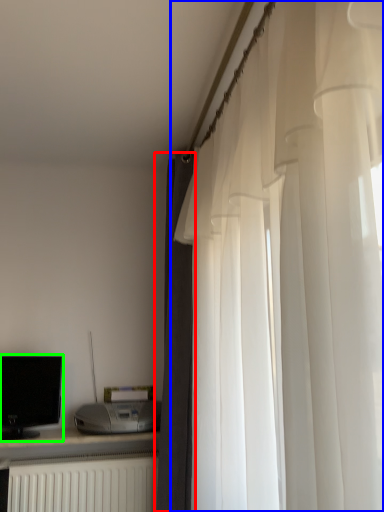
Question: Which object is the farthest from curtain (highlighted by a red box)? Choose among these: curtain (highlighted by a blue box) or computer monitor (highlighted by a green box).

Choices:
 (A) curtain
 (B) computer monitor

Answer: (A)